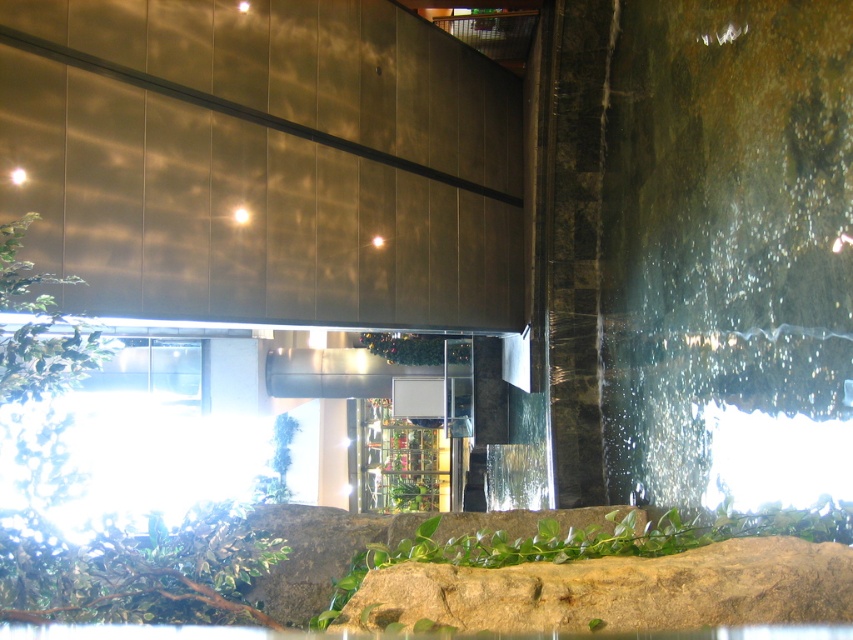
You are standing in the lobby and see the green leafy plant at center and the green glossy plant at center. Which one is positioned lower in the image?

The green leafy plant at center is positioned lower than the green glossy plant at center.

You are standing in the lobby and want to water both the green leafy plant at center and the green glossy plant at center. Which plant should you water first if you want to start with the one nearest to you?

You should water the green leafy plant at center first because it is closer to you than the green glossy plant at center.

You are an interior designer planning to place a 10 meter long sofa between the green leafy plant at center and the green glossy plant at center. Is there enough space between them to fit the sofa?

The distance between the green leafy plant at center and the green glossy plant at center is 8.52 meters, which is shorter than the 10 meter sofa. Therefore, the sofa would not fit between them.